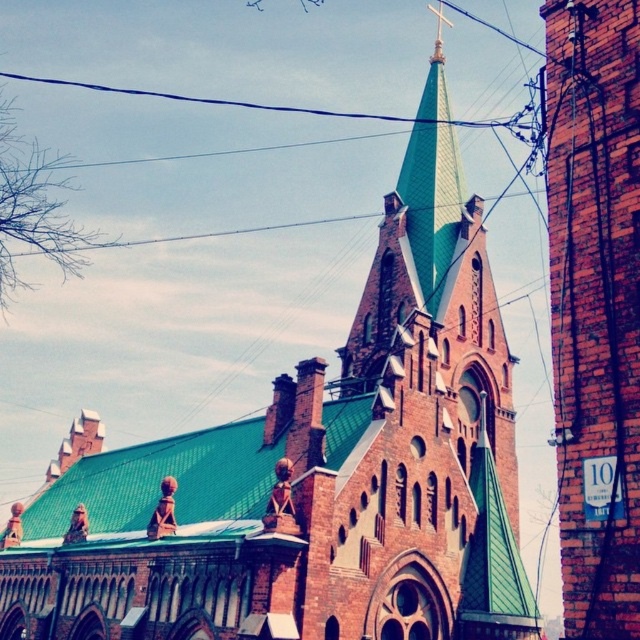
You are standing in front of the church and notice two points on its structure. The first point is at coordinates point (433, 186) and the second is at point (360, 116). Which of these points is nearer to you?

Point (433, 186) is closer to the viewer than point (360, 116).

What are the coordinates of the green tiled spire at center?

The green tiled spire at center is located at coordinates point (432, 182).